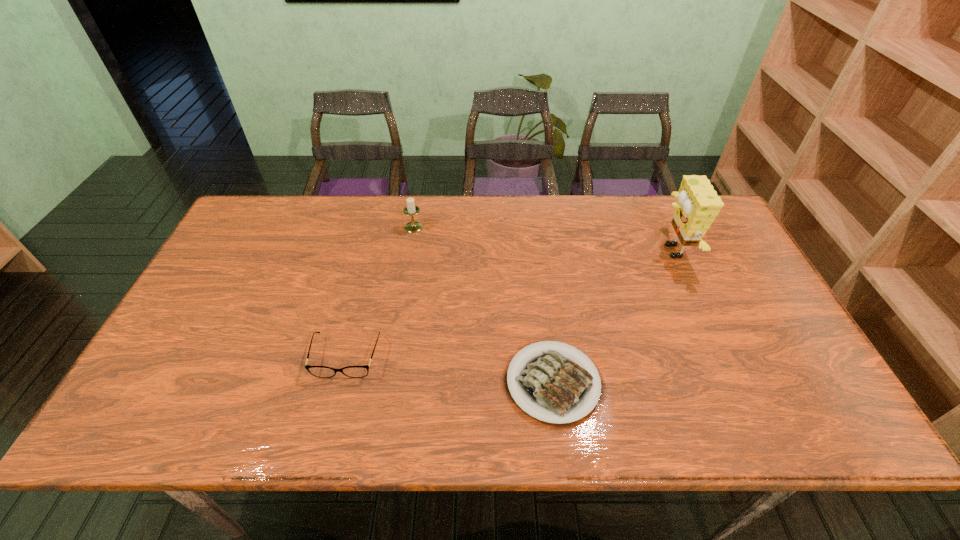
What are the coordinates of `free space at the near edge` in the screenshot? It's located at (485, 428).

Image resolution: width=960 pixels, height=540 pixels. Find the location of `free space at the left edge of the desktop`. free space at the left edge of the desktop is located at coordinates click(164, 379).

Where is `vacant region at the far left corner`? This screenshot has height=540, width=960. vacant region at the far left corner is located at coordinates (298, 199).

The width and height of the screenshot is (960, 540). In order to click on free space at the far right corner in this screenshot , I will do `click(669, 214)`.

Where is `empty location between the sponge and the leftmost object`? empty location between the sponge and the leftmost object is located at coordinates (509, 304).

At what (x,y) coordinates should I click in order to perform the action: click on free space between the second object from left to right and the second shortest object. Please return your answer as a coordinate pair (x, y). This screenshot has height=540, width=960. Looking at the image, I should click on click(x=380, y=292).

The width and height of the screenshot is (960, 540). Identify the location of unoccupied position between the candle holder and the spectacles. (380, 292).

Where is `vacant region between the second shortest object and the third object from left to right`? This screenshot has height=540, width=960. vacant region between the second shortest object and the third object from left to right is located at coordinates (449, 369).

I want to click on free space that is in between the third object from left to right and the second shortest object, so click(x=449, y=369).

Where is `free space between the third object from right to left and the sponge`? free space between the third object from right to left and the sponge is located at coordinates (542, 239).